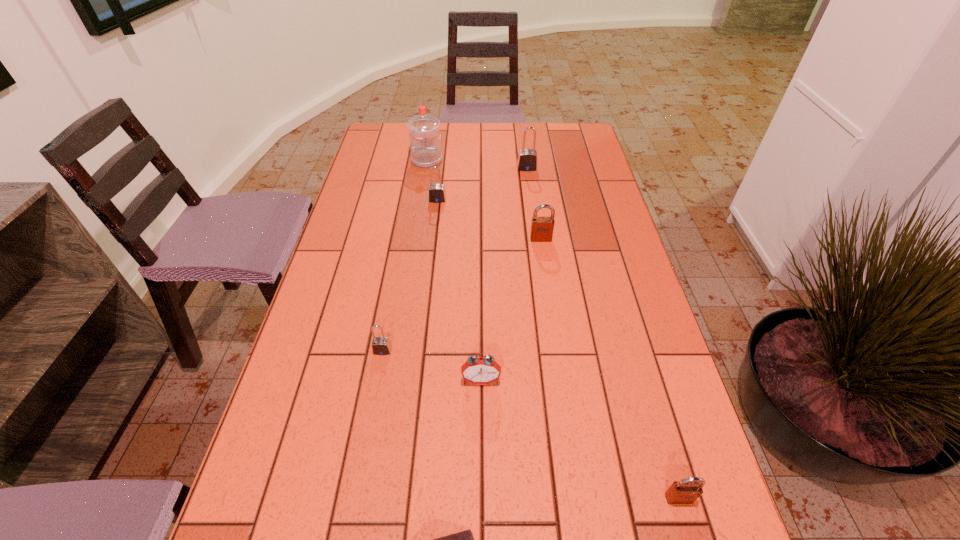
Locate an element on the screen. The image size is (960, 540). object that is at the far edge is located at coordinates (424, 136).

This screenshot has width=960, height=540. In order to click on object that is at the right edge in this screenshot , I will do `click(686, 491)`.

This screenshot has width=960, height=540. What are the coordinates of `vacant area at the far edge of the desktop` in the screenshot? It's located at (461, 134).

Image resolution: width=960 pixels, height=540 pixels. In the image, there is a desktop. In order to click on vacant space at the left edge in this screenshot , I will do [x=360, y=239].

This screenshot has height=540, width=960. Find the location of `free space at the right edge`. free space at the right edge is located at coordinates (657, 383).

Image resolution: width=960 pixels, height=540 pixels. In order to click on vacant space at the far left corner of the desktop in this screenshot , I will do `click(373, 151)`.

Find the location of `free space at the far right corner of the desktop`. free space at the far right corner of the desktop is located at coordinates (560, 152).

Locate an element on the screen. This screenshot has width=960, height=540. unoccupied area between the smaller brown padlock and the fourth nearest padlock is located at coordinates (558, 349).

You are a GUI agent. You are given a task and a screenshot of the screen. Output one action in this format:
    pyautogui.click(x=<x>, y=<y>)
    Task: Click on the unoccupied area between the farther brown padlock and the tallest padlock
    The image size is (960, 540).
    Given the screenshot: What is the action you would take?
    pyautogui.click(x=534, y=204)

Where is `unoccupied position between the farthest gray padlock and the second smallest gray padlock`? unoccupied position between the farthest gray padlock and the second smallest gray padlock is located at coordinates (482, 184).